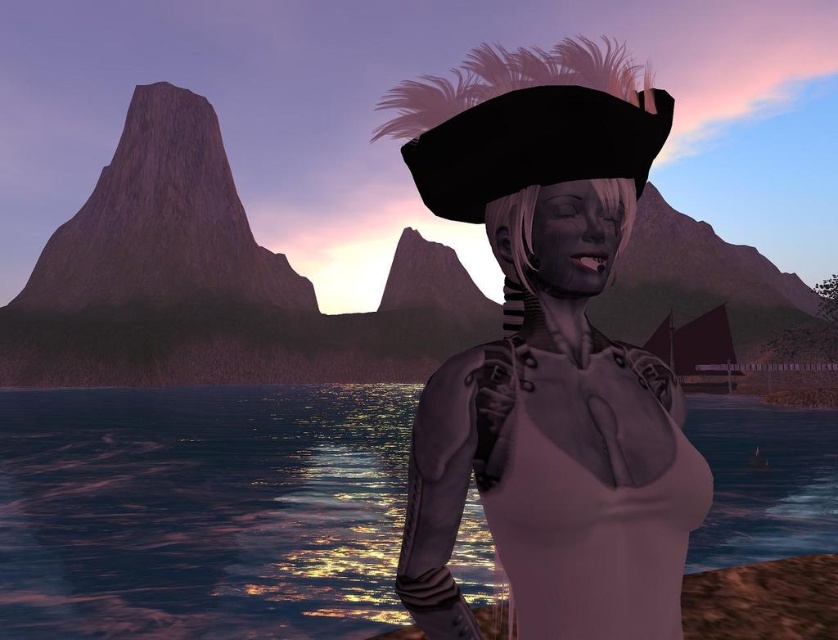
Question: From the image, what is the correct spatial relationship of glistening water at center in relation to satin pink dress at center?

Choices:
 (A) below
 (B) above

Answer: (A)

Question: Does matte black pirate hat at center appear on the left side of satin pink dress at center?

Choices:
 (A) yes
 (B) no

Answer: (A)

Question: Considering the real-world distances, which object is farthest from the glistening water at center?

Choices:
 (A) matte black pirate hat at center
 (B) satin pink dress at center

Answer: (A)

Question: Which of the following is the farthest from the observer?

Choices:
 (A) (564, 596)
 (B) (834, 502)

Answer: (B)

Question: Is glistening water at center below satin pink dress at center?

Choices:
 (A) no
 (B) yes

Answer: (B)

Question: Which of the following is the farthest from the observer?

Choices:
 (A) (795, 522)
 (B) (635, 177)
 (C) (593, 564)

Answer: (A)